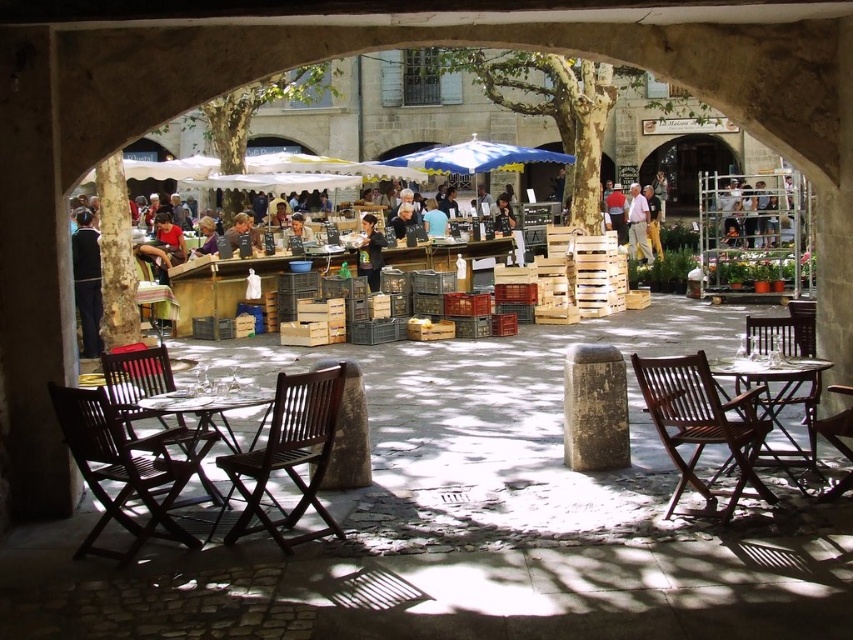
Question: Which point is closer to the camera?

Choices:
 (A) (163, 346)
 (B) (611, 211)
 (C) (114, 419)
 (D) (843, 486)

Answer: (C)

Question: Which of the following is the closest to the observer?

Choices:
 (A) wooden chair at lower left
 (B) wooden folding table at lower right
 (C) light brown wooden chair at center right
 (D) brown wooden chair at lower right

Answer: (A)

Question: Is wooden chair at lower left further to camera compared to wooden folding table at lower right?

Choices:
 (A) yes
 (B) no

Answer: (B)

Question: Among these objects, which one is nearest to the camera?

Choices:
 (A) wooden chair at lower left
 (B) brown wooden chair at lower right
 (C) light brown wooden chair at center
 (D) light brown wooden chair at center right

Answer: (A)

Question: Does wooden chair at lower left lie in front of light brown wooden chair at center?

Choices:
 (A) yes
 (B) no

Answer: (A)

Question: Is light brown wooden chair at center right above dark brown leather jacket at center?

Choices:
 (A) no
 (B) yes

Answer: (B)